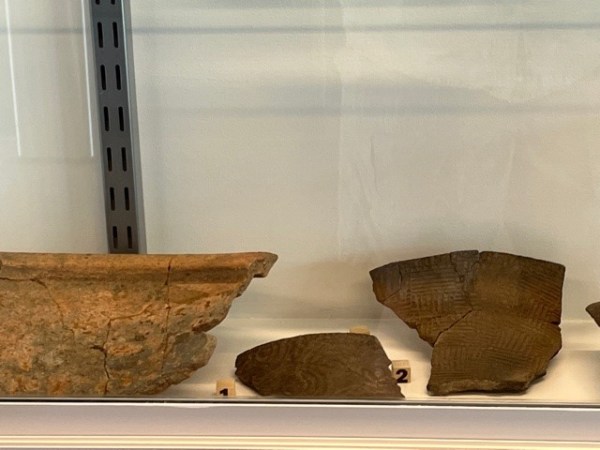
The height and width of the screenshot is (450, 600). In order to click on vase in this screenshot , I will do click(x=468, y=325).